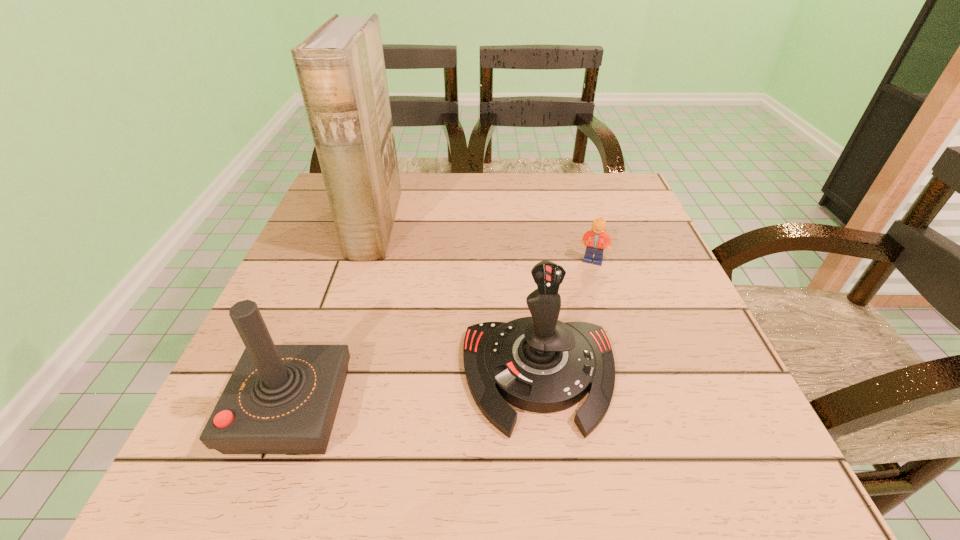
Locate an element on the screen. phonebook is located at coordinates tap(340, 67).

Find the location of a particular element. The width and height of the screenshot is (960, 540). the left joystick is located at coordinates (280, 399).

Locate an element on the screen. The height and width of the screenshot is (540, 960). the right joystick is located at coordinates (539, 364).

You are a GUI agent. You are given a task and a screenshot of the screen. Output one action in this format:
    pyautogui.click(x=<x>, y=<y>)
    Task: Click on the Lego
    Image resolution: width=960 pixels, height=540 pixels.
    Given the screenshot: What is the action you would take?
    pyautogui.click(x=597, y=238)

I want to click on vacant space located on the cover of the phonebook, so click(x=528, y=226).

Find the location of a particular element. free space located on the rectangular base of the left joystick is located at coordinates pos(589,409).

Find the location of a particular element. Image resolution: width=960 pixels, height=540 pixels. vacant space located on the front-facing side of the Lego is located at coordinates 638,411.

I want to click on object present at the far edge, so click(x=340, y=67).

Where is `object present at the near edge`? The width and height of the screenshot is (960, 540). object present at the near edge is located at coordinates (280, 399).

Identify the location of phonebook that is at the left edge. This screenshot has width=960, height=540. click(340, 67).